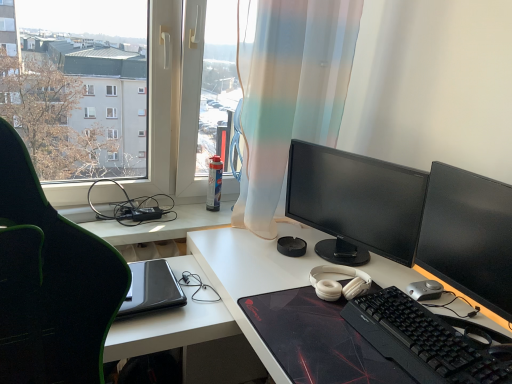
At what (x,y) coordinates should I click in order to perform the action: click on free space that is to the left of matte black monitor at center, the 1th computer monitor when ordered from back to front. Please return your answer as a coordinate pair (x, y). Image resolution: width=512 pixels, height=384 pixels. Looking at the image, I should click on (259, 265).